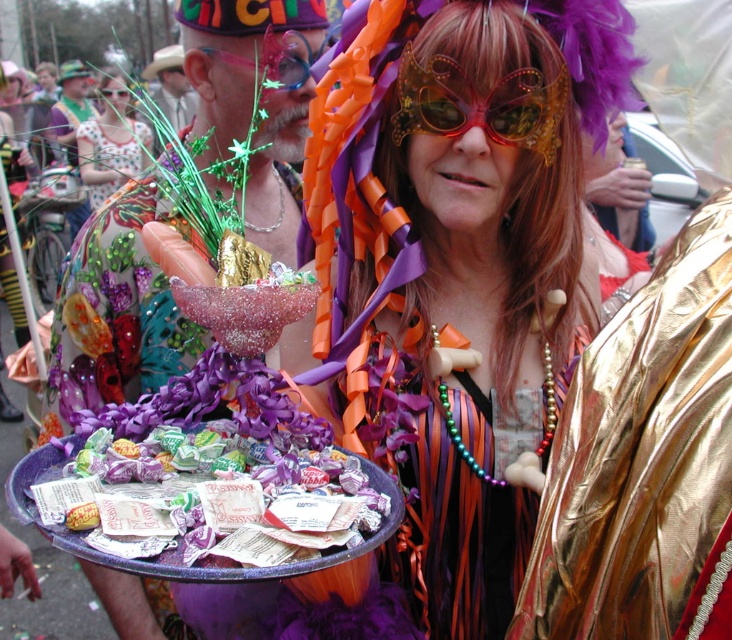
You are a photographer standing at the camera position. You want to capture a closeup shot of the shiny metallic tray at center without moving the camera. Is it possible to do so with a standard zoom lens that has a maximum zoom range of 2 meters?

The shiny metallic tray at center is 1.64 meters away from camera. Since the maximum zoom range is 2 meters, the photographer can zoom in to capture a closeup of the shiny metallic tray at center without moving the camera.

You are a photographer at the Mardi Gras parade. You need to capture a photo of both the shiny metallic tray at center and the metallic gold goggles at center. Which object should you focus on first if you want to ensure both are in frame without moving the camera?

The shiny metallic tray at center is taller than the metallic gold goggles at center, so you should focus on the shiny metallic tray at center first to ensure both are in frame.

You are a photographer at the Mardi Gras parade and want to capture both the shiny metallic tray at center and the metallic gold goggles at center in a single photo. Which object should you position on the left side of the frame to ensure both are visible?

The metallic gold goggles at center should be positioned on the left side of the frame because the shiny metallic tray at center is to the right of it, so placing the goggles on the left will allow the tray to naturally be on the right side, ensuring both are visible in the photo.